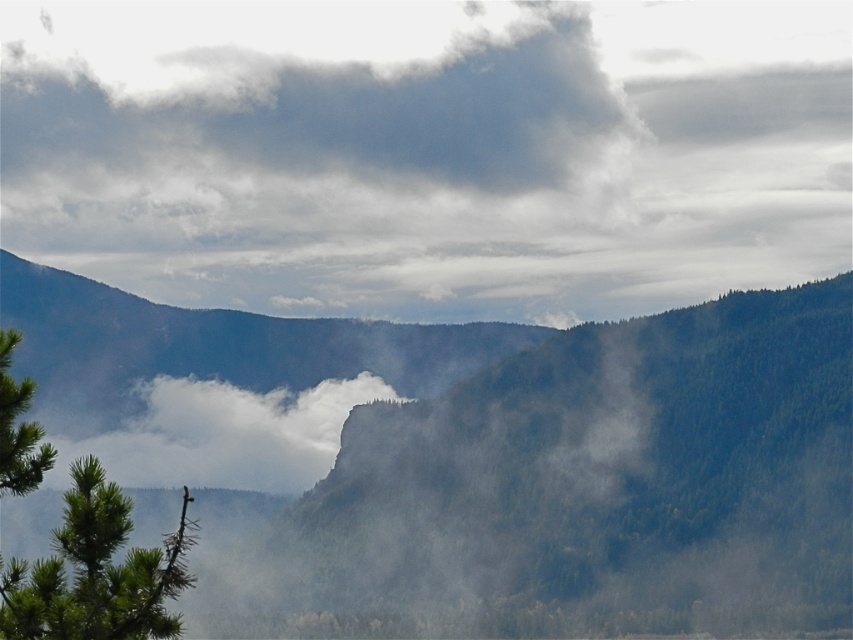
You are a hiker who wants to take a photo of the green forested mountain at center. However, you notice a gray fluffy cloud at upper center might block your view. Based on the distance between them, can you estimate whether the cloud will obscure the mountain in your photo?

The gray fluffy cloud at upper center is 44.19 meters away from the green forested mountain at center. Since the distance is relatively large, the cloud is unlikely to completely obscure the mountain in your photo.

You are an aerial photographer planning to capture the misty valley scene. You want to position your drone to focus on the gray fluffy cloud at upper center. According to the coordinates provided, where should the drone aim its camera to ensure the cloud is centered in the frame?

The gray fluffy cloud at upper center is located at point (427, 150), so the drone should aim its camera at those coordinates to center the cloud in the frame.